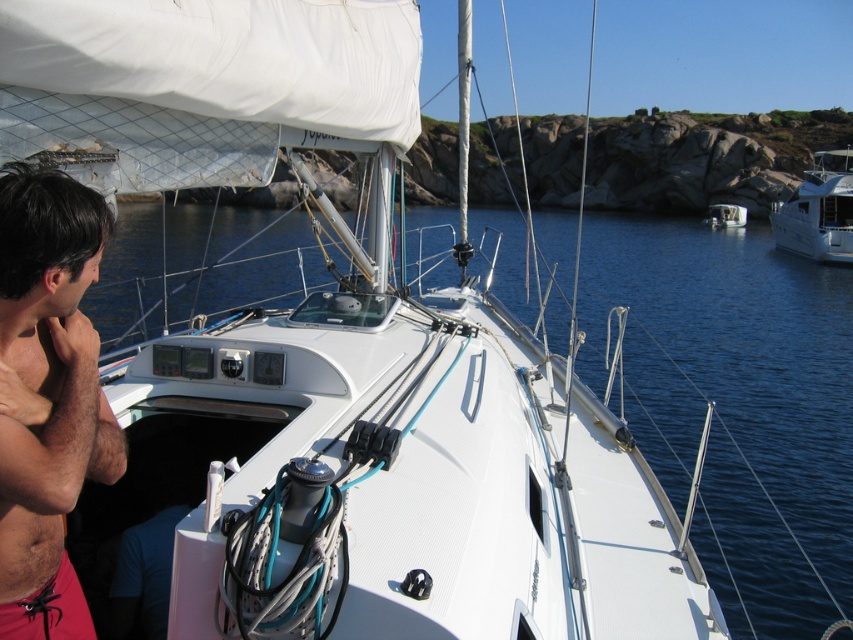
Question: Which object is positioned farthest from the white glossy boat at right?

Choices:
 (A) white glossy boat at center
 (B) shiny black hair at left
 (C) hair/fuzzy skin at left

Answer: (C)

Question: Which point is closer to the camera taking this photo?

Choices:
 (A) (x=737, y=216)
 (B) (x=51, y=582)

Answer: (B)

Question: Which of the following is the farthest from the observer?

Choices:
 (A) (741, 214)
 (B) (47, 538)
 (C) (9, 472)
 (D) (817, 209)

Answer: (A)

Question: Observing the image, what is the correct spatial positioning of hair/fuzzy skin at left in reference to white glossy boat at right?

Choices:
 (A) right
 (B) left

Answer: (B)

Question: Is shiny black hair at left thinner than hair/fuzzy skin at left?

Choices:
 (A) no
 (B) yes

Answer: (B)

Question: Does white glossy boat at right appear under white glossy boat at center?

Choices:
 (A) no
 (B) yes

Answer: (B)